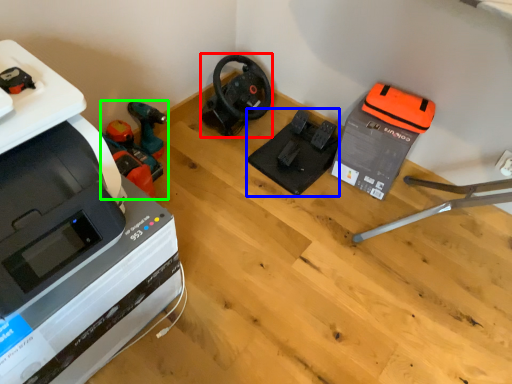
Question: Considering the real-world distances, which object is closest to vacuum (highlighted by a red box)? equipment (highlighted by a blue box) or vacuum (highlighted by a green box).

Choices:
 (A) equipment
 (B) vacuum

Answer: (A)